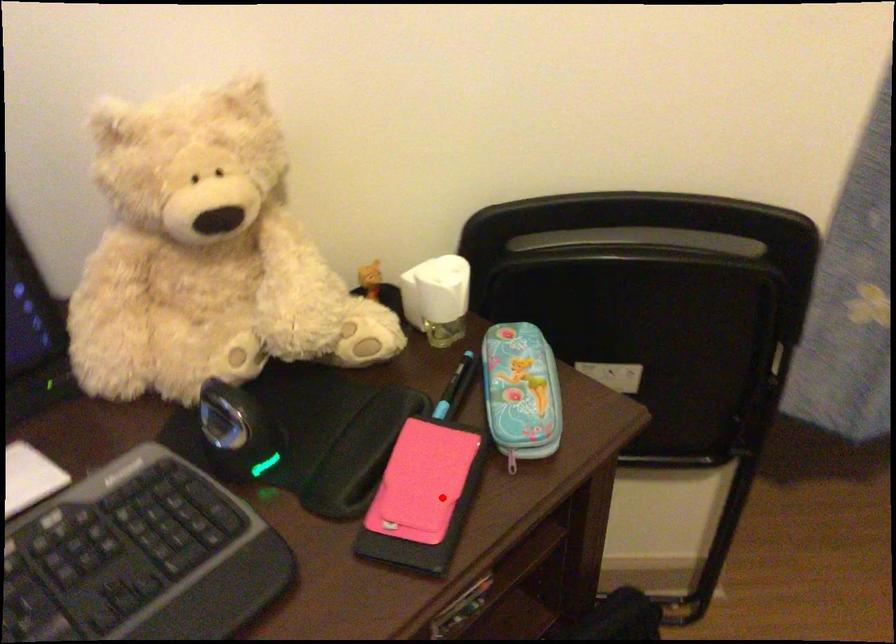
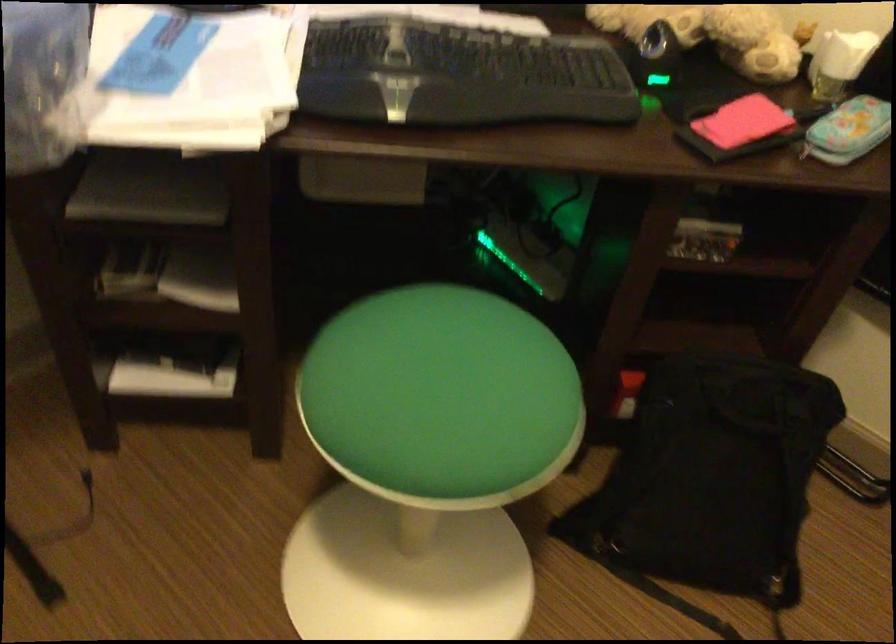
The point at the highlighted location is marked in the first image. Where is the corresponding point in the second image?

(739, 128)